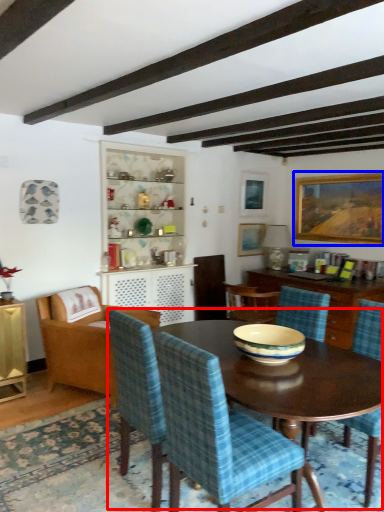
Question: Which point is further to the camera, kitchen & dining room table (highlighted by a red box) or picture frame (highlighted by a blue box)?

Choices:
 (A) kitchen & dining room table
 (B) picture frame

Answer: (B)